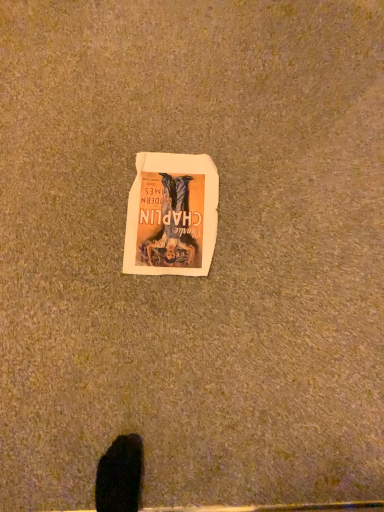
The width and height of the screenshot is (384, 512). Find the location of `blank space situated above matte paper poster at center (from a real-world perspective)`. blank space situated above matte paper poster at center (from a real-world perspective) is located at coordinates (162, 207).